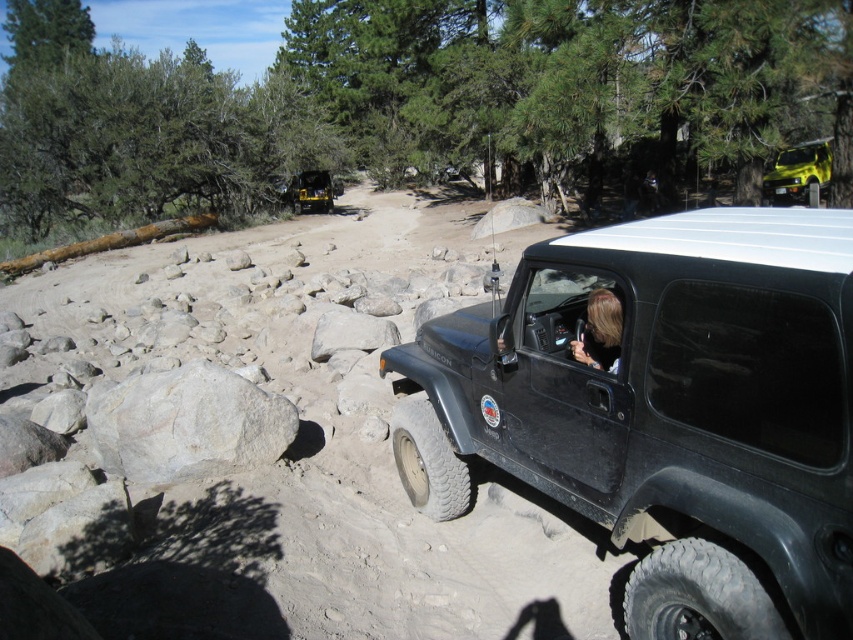
Between point (643, 588) and point (798, 166), which one is positioned behind?

Point (798, 166)

Can you confirm if matte black jeep at center is shorter than shiny yellow car at upper right?

Yes.

This screenshot has width=853, height=640. I want to click on matte black jeep at center, so click(666, 412).

Identify the location of gray rough rock at lower left. The height and width of the screenshot is (640, 853). (189, 424).

Who is more distant from viewer, (149, 470) or (300, 192)?

The point (300, 192) is more distant.

At what (x,y) coordinates should I click in order to perform the action: click on gray rough rock at lower left. Please return your answer as a coordinate pair (x, y). The height and width of the screenshot is (640, 853). Looking at the image, I should click on pos(189,424).

Does matte black jeep at center appear over matte yellow truck at center?

No, matte black jeep at center is not above matte yellow truck at center.

Find the location of a particular element. This screenshot has width=853, height=640. matte black jeep at center is located at coordinates (666, 412).

Is point (834, 269) closer to viewer compared to point (318, 196)?

Yes, point (834, 269) is in front of point (318, 196).

This screenshot has height=640, width=853. What are the coordinates of `matte black jeep at center` in the screenshot? It's located at (666, 412).